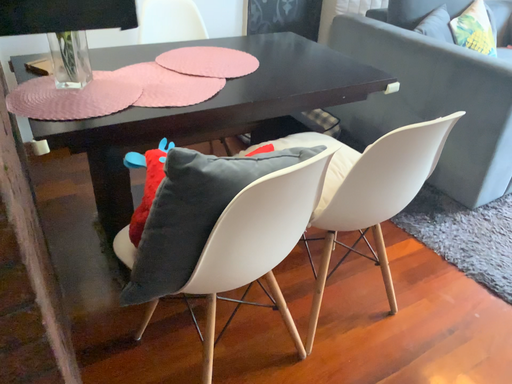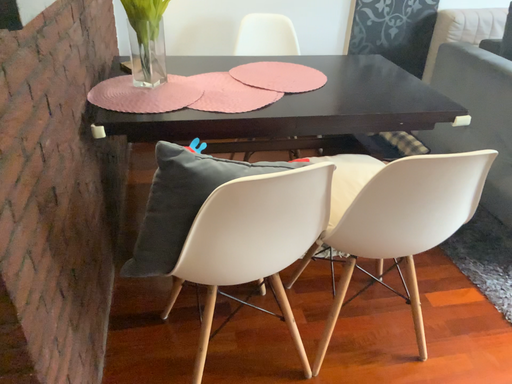
Question: How did the camera likely rotate when shooting the video?

Choices:
 (A) rotated left
 (B) rotated right

Answer: (A)